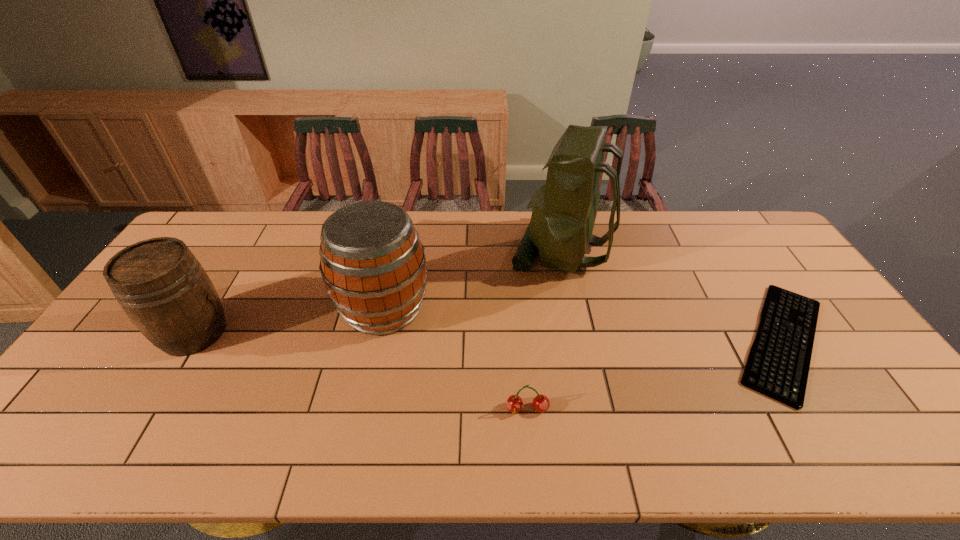
Locate an element on the screen. blank space located 0.060m on the front of the fourth object from right to left is located at coordinates (372, 363).

Image resolution: width=960 pixels, height=540 pixels. In order to click on vacant space located 0.200m on the side of the left cider near the bung hole in this screenshot , I will do `click(301, 333)`.

Where is `free region located with stems pointing upwards on the second shortest object`? The width and height of the screenshot is (960, 540). free region located with stems pointing upwards on the second shortest object is located at coordinates (532, 463).

I want to click on vacant space situated 0.360m on the left of the computer keyboard, so click(588, 341).

Locate an element on the screen. object located in the far edge section of the desktop is located at coordinates (564, 210).

Find the location of a particular element. object that is at the left edge is located at coordinates (163, 289).

Identify the location of object that is at the right edge. (778, 362).

Where is `vacant area at the far edge`? This screenshot has width=960, height=540. vacant area at the far edge is located at coordinates (489, 244).

This screenshot has height=540, width=960. What are the coordinates of `vacant position at the left edge of the desktop` in the screenshot? It's located at pyautogui.click(x=96, y=396).

This screenshot has width=960, height=540. In the image, there is a desktop. Identify the location of blank space at the right edge. (821, 328).